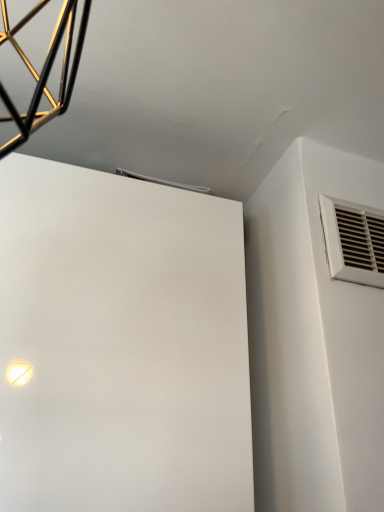
This screenshot has width=384, height=512. Describe the element at coordinates (353, 241) in the screenshot. I see `white plastic vent at upper right` at that location.

Locate an element on the screen. The image size is (384, 512). white plastic vent at upper right is located at coordinates (353, 241).

At what (x,y) coordinates should I click in order to perform the action: click on white plastic vent at upper right. Please return your answer as a coordinate pair (x, y). Looking at the image, I should click on (353, 241).